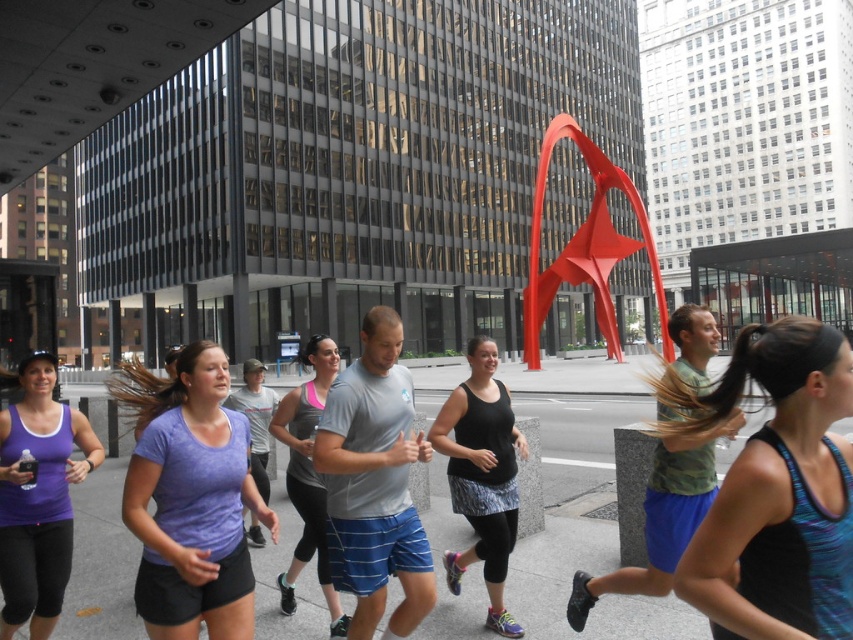
You are a photographer standing at the starting line of a city marathon. You want to capture a photo of the purple matte tank top at lower left and the camouflage fabric shirt at center in the same frame. Given that your camera has a focal length that can cover a maximum distance of 3 meters between subjects, will you be able to include both in the shot?

The purple matte tank top at lower left and the camouflage fabric shirt at center are 3.25 meters apart. Since the camera can only cover up to 3 meters, the distance between them exceeds the camera range. Therefore, both subjects cannot be captured in the same frame.